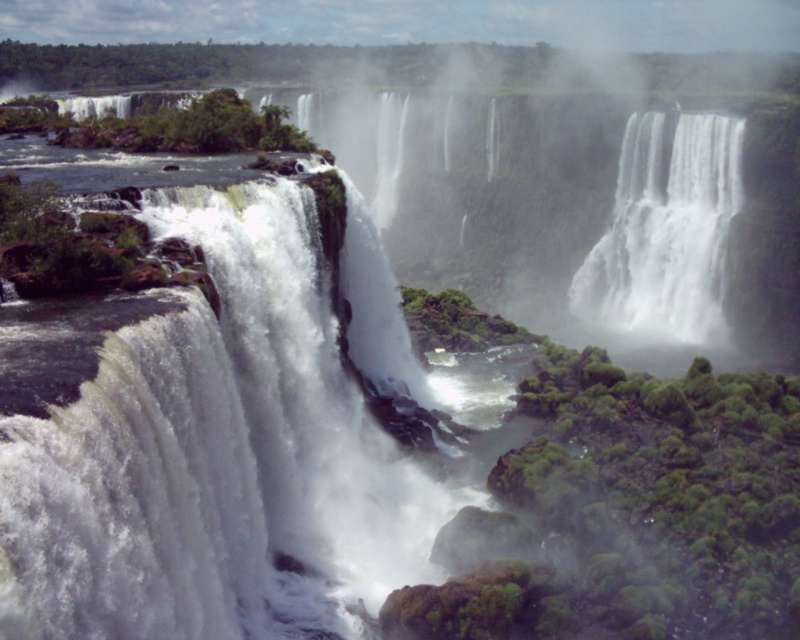
Is white frothy water at left to the right of white frothy water at center from the viewer's perspective?

Incorrect, white frothy water at left is not on the right side of white frothy water at center.

What are the coordinates of `white frothy water at left` in the screenshot? It's located at (214, 458).

Is point (292, 396) positioned before point (620, 272)?

Yes, it is in front of point (620, 272).

Identify the location of white frothy water at left. The height and width of the screenshot is (640, 800). (214, 458).